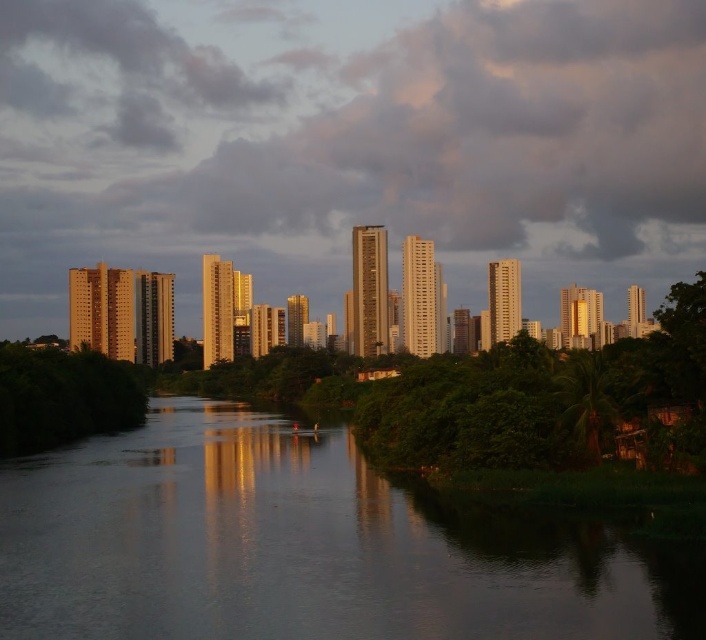
You are standing on a bridge overlooking the river and see the gray cloudy sky at upper center and the green leafy tree at lower left. Which object appears closer to you?

The green leafy tree at lower left appears closer to you because it is positioned in front of the gray cloudy sky at upper center.

You are standing at the edge of a river and see the smooth reflective water at center and the green leafy tree at lower left. Which object is closer to your right side?

The smooth reflective water at center is to the right of the green leafy tree at lower left, so if you are facing the river, the smooth reflective water at center would be closer to your right side.

You are standing on a bridge overlooking the gray cloudy sky at upper center and the green leafy tree at lower left. If you want to take a photo that includes both the sky and the tree, which one should you frame first in your camera viewfinder to ensure they both fit in the shot?

You should frame the gray cloudy sky at upper center first because it might be wider than the green leafy tree at lower left, ensuring both elements fit within the viewfinder.